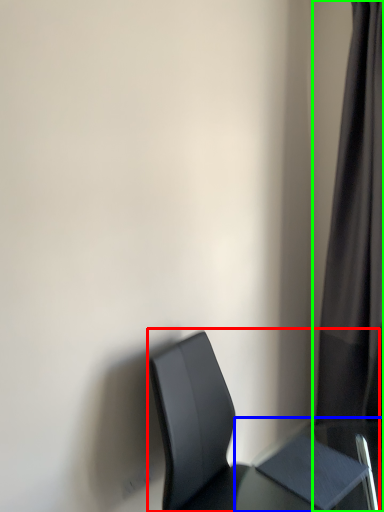
Question: Estimate the real-world distances between objects in this image. Which object is farther from chair (highlighted by a red box), table (highlighted by a blue box) or curtain (highlighted by a green box)?

Choices:
 (A) table
 (B) curtain

Answer: (B)